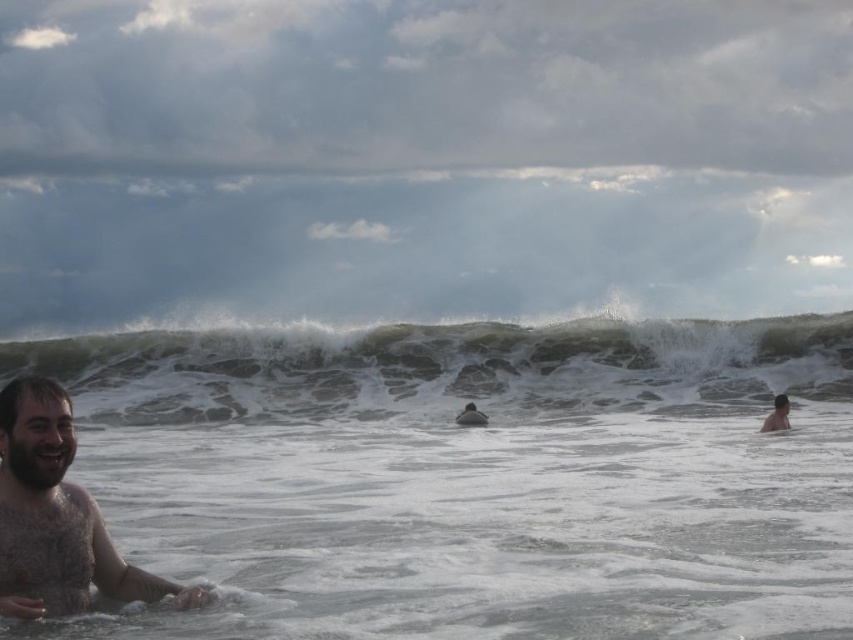
Between point (788, 490) and point (624, 378), which one is positioned in front?

Point (788, 490)

Is point (527, 376) positioned behind point (170, 416)?

Yes.

Between point (749, 465) and point (781, 371), which one is positioned in front?

Positioned in front is point (749, 465).

The width and height of the screenshot is (853, 640). Find the location of `white frothy water at lower left`. white frothy water at lower left is located at coordinates (471, 477).

Does point (170, 586) come in front of point (776, 428)?

Yes, point (170, 586) is closer to viewer.

Can you confirm if bearded wet man at left is taller than skinny white man at lower right?

Correct, bearded wet man at left is much taller as skinny white man at lower right.

Which is in front, point (119, 570) or point (766, 419)?

Point (119, 570) is more forward.

The image size is (853, 640). Identify the location of bearded wet man at left. (56, 516).

This screenshot has width=853, height=640. Identify the location of white frothy water at lower left. (471, 477).

Is white frothy water at lower left shorter than bearded wet man at left?

Incorrect, white frothy water at lower left's height does not fall short of bearded wet man at left's.

Which is behind, point (148, 470) or point (9, 538)?

The point (148, 470) is more distant.

Where is `white frothy water at lower left`? This screenshot has width=853, height=640. white frothy water at lower left is located at coordinates (471, 477).